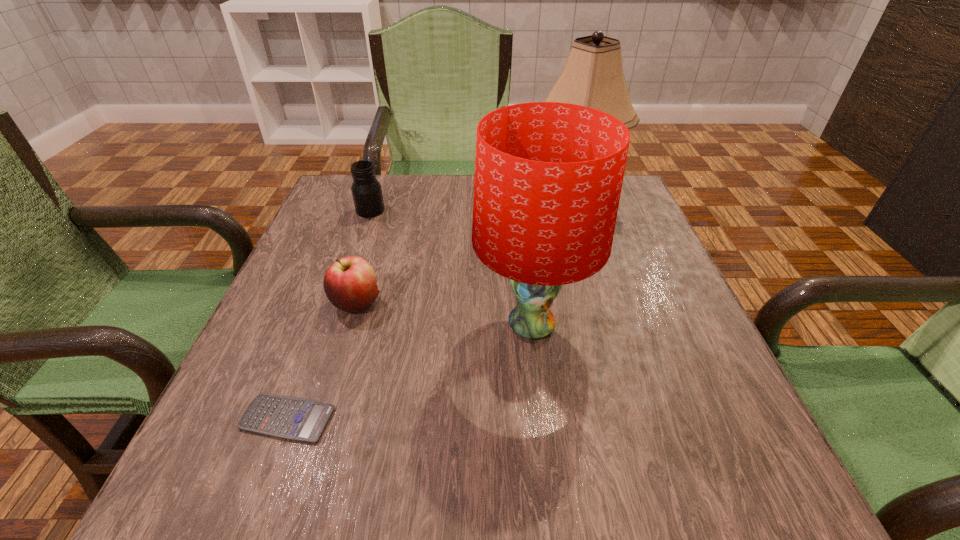
This screenshot has height=540, width=960. Identify the location of free spot that satisfies the following two spatial constraints: 1. on the front-facing side of the lampshade; 2. on the front side of the nearest object. point(542,418).

Find the location of a particular element. The width and height of the screenshot is (960, 540). vacant point that satisfies the following two spatial constraints: 1. on the back side of the fourth tallest object; 2. on the left side of the nearest object is located at coordinates (330, 303).